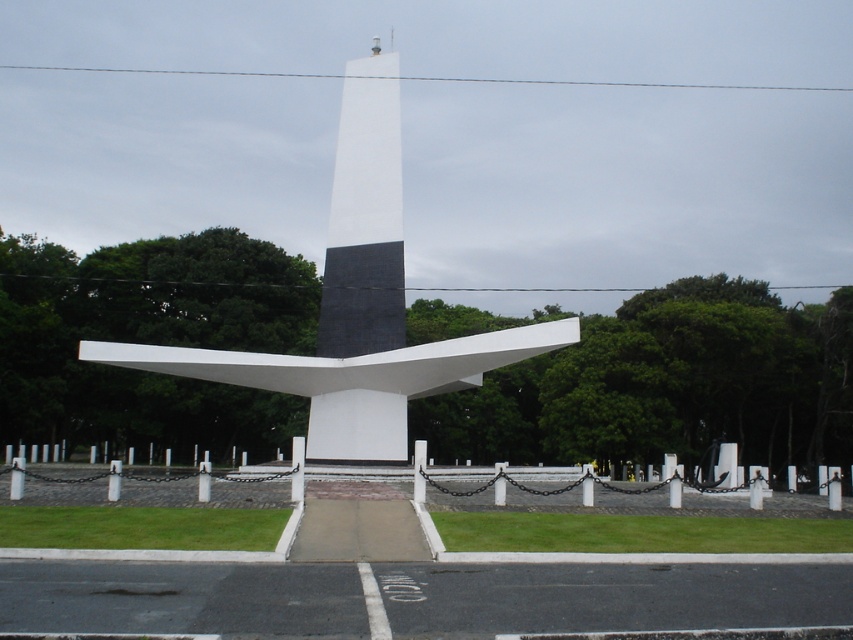
You are a maintenance worker tasked with cleaning the monument. You have a 2.0 meter long telescoping pole. Can you reach from the white polished stone obelisk at center to the white smooth tower at center using the pole without moving it?

The white polished stone obelisk at center and the white smooth tower at center are 1.86 meters apart. Since the telescoping pole is 2.0 meters long, it can extend beyond the distance between them, so yes, you can reach from the white polished stone obelisk at center to the white smooth tower at center using the pole without moving it.

Looking at this image, you are standing at the entrance of the monument area and want to reach the white polished stone obelisk at center. According to the coordinates provided, in which direction should you walk to reach it?

The white polished stone obelisk at center is located at coordinates point [357,305]. Since you are at the entrance, you should walk towards the center area where the obelisk is situated based on the coordinates provided.